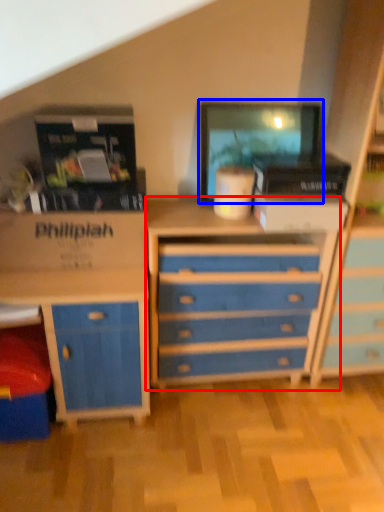
Question: Which point is closer to the camera, chest of drawers (highlighted by a red box) or computer monitor (highlighted by a blue box)?

Choices:
 (A) chest of drawers
 (B) computer monitor

Answer: (A)